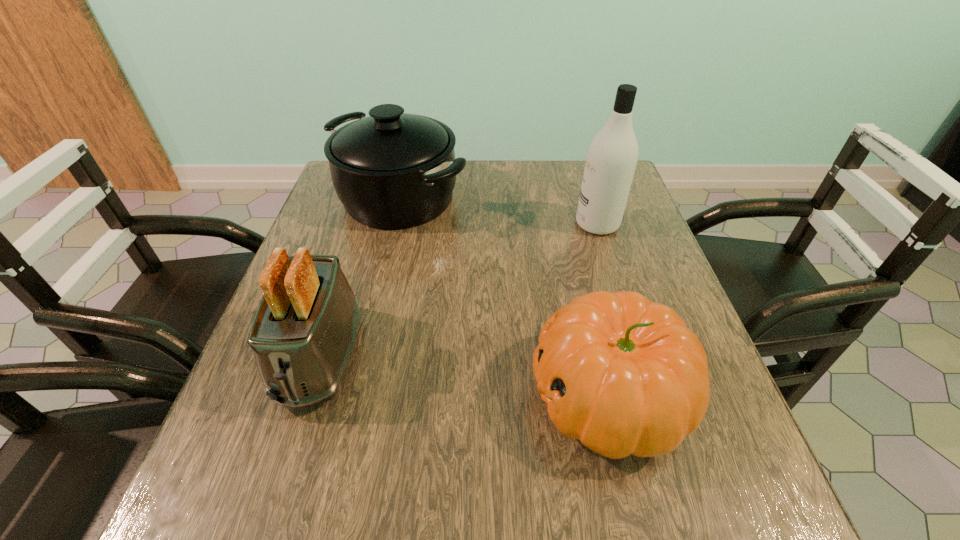
Where is `free region located 0.210m on the carved face of the pumpkin`? free region located 0.210m on the carved face of the pumpkin is located at coordinates (409, 395).

The height and width of the screenshot is (540, 960). In order to click on vacant space located on the carved face of the pumpkin in this screenshot , I will do `click(347, 395)`.

Identify the location of object positioned at the far edge. (392, 170).

Locate an element on the screen. Image resolution: width=960 pixels, height=540 pixels. object at the near edge is located at coordinates (625, 376).

Where is `saucepan at the left edge`? The image size is (960, 540). saucepan at the left edge is located at coordinates (392, 170).

The width and height of the screenshot is (960, 540). What are the coordinates of `toaster positioned at the left edge` in the screenshot? It's located at (304, 331).

The image size is (960, 540). What are the coordinates of `shampoo that is positioned at the right edge` in the screenshot? It's located at (611, 160).

Identify the location of pumpkin that is at the right edge. The image size is (960, 540). (625, 376).

The width and height of the screenshot is (960, 540). I want to click on object present at the far left corner, so click(x=392, y=170).

At what (x,y) coordinates should I click in order to perform the action: click on object that is at the near right corner. Please return your answer as a coordinate pair (x, y). The height and width of the screenshot is (540, 960). Looking at the image, I should click on (625, 376).